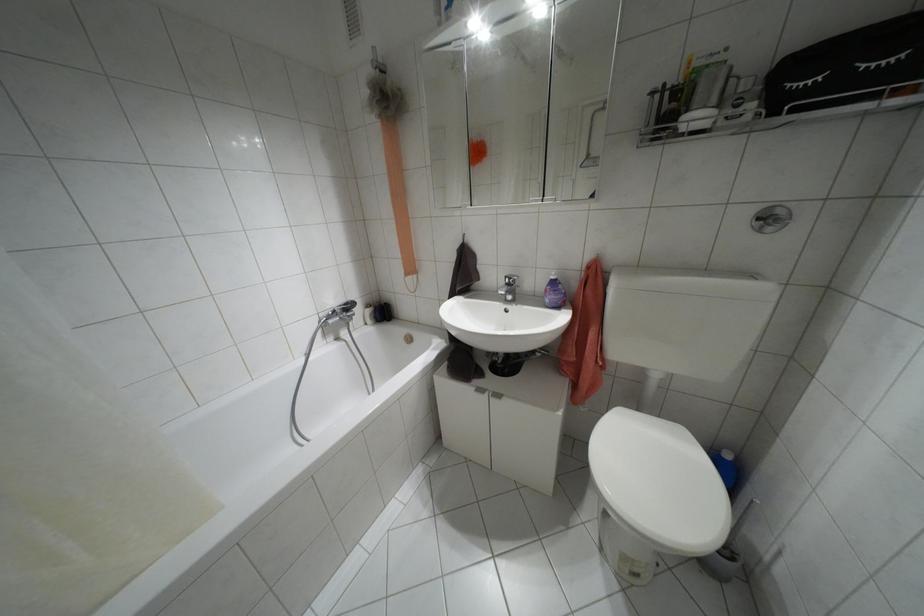
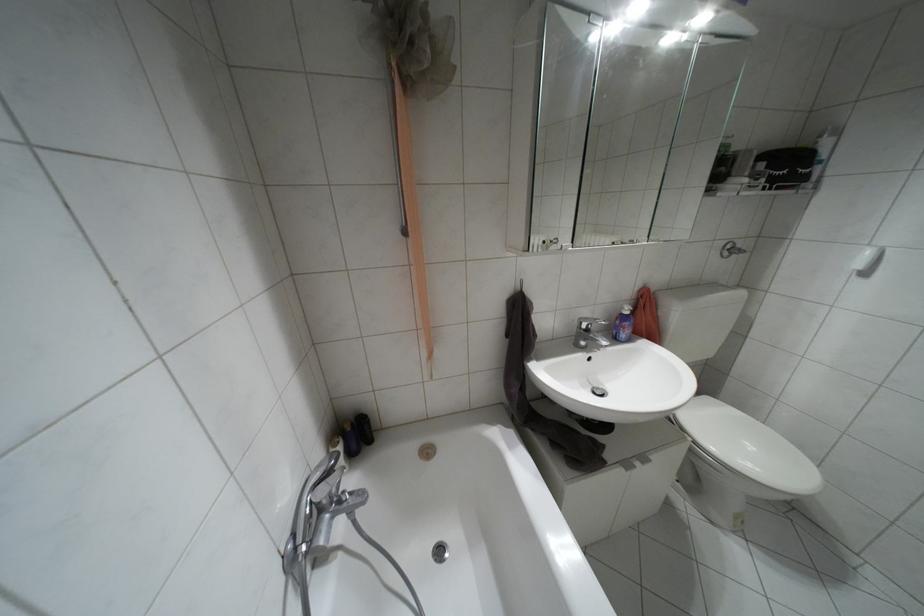
Where in the second image is the point corresponding to the point at 769,228 from the first image?

(723, 254)